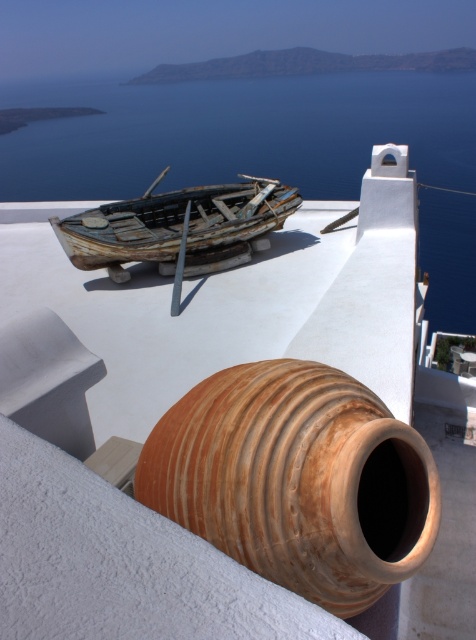
Question: Does blue water at upper center appear on the right side of brown clay pot at center?

Choices:
 (A) no
 (B) yes

Answer: (A)

Question: Which of the following is the farthest from the observer?

Choices:
 (A) (106, 234)
 (B) (179, 144)

Answer: (B)

Question: Among these points, which one is nearest to the camera?

Choices:
 (A) (442, 209)
 (B) (113, 257)
 (C) (305, 429)

Answer: (C)

Question: Can you confirm if blue water at upper center is smaller than brown clay pot at center?

Choices:
 (A) no
 (B) yes

Answer: (A)

Question: Can you confirm if blue water at upper center is smaller than brown clay pot at center?

Choices:
 (A) yes
 (B) no

Answer: (B)

Question: Estimate the real-world distances between objects in this image. Which object is closer to the rusty wood boat at center?

Choices:
 (A) blue water at upper center
 (B) brown clay pot at center

Answer: (B)